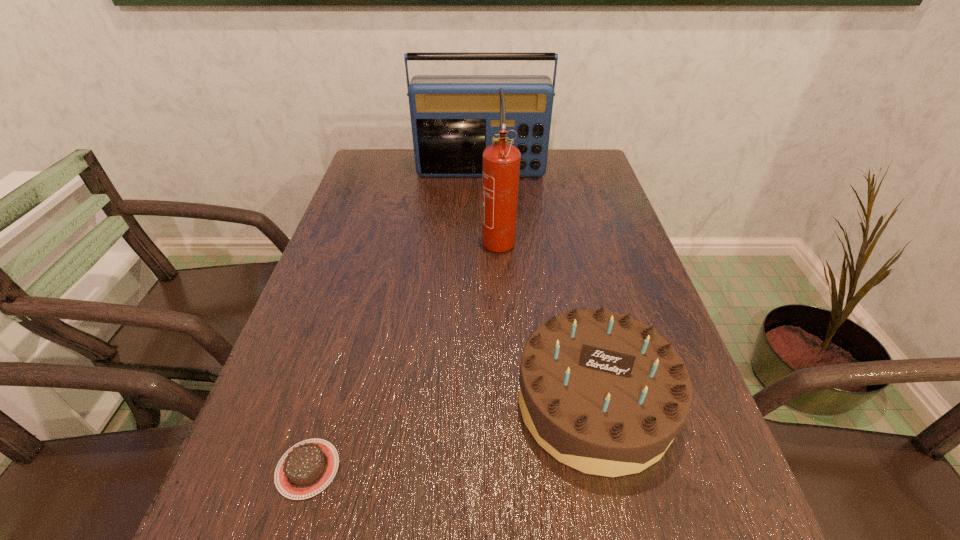
Locate an element on the screen. The width and height of the screenshot is (960, 540). object positioned at the left edge is located at coordinates 307,468.

Where is `object located at the right edge`? This screenshot has width=960, height=540. object located at the right edge is located at coordinates (603, 393).

In the image, there is a desktop. At what (x,y) coordinates should I click in order to perform the action: click on vacant space at the left edge. Please return your answer as a coordinate pair (x, y). Looking at the image, I should click on (354, 268).

Find the location of a particular element. This screenshot has height=540, width=960. vacant point at the right edge is located at coordinates (586, 238).

This screenshot has height=540, width=960. Find the location of `free location at the far right corner`. free location at the far right corner is located at coordinates (564, 181).

The width and height of the screenshot is (960, 540). Find the location of `free point between the farthest object and the birthday cake`. free point between the farthest object and the birthday cake is located at coordinates (538, 287).

At what (x,y) coordinates should I click in order to perform the action: click on vacant region between the second shortest object and the leftmost object. Please return your answer as a coordinate pair (x, y). Looking at the image, I should click on (451, 435).

Identify the location of free space between the third tallest object and the shortest object. (451, 435).

The width and height of the screenshot is (960, 540). What are the coordinates of `vacant space that is in between the leftmost object and the second shortest object` in the screenshot? It's located at (451, 435).

Identify the location of empty space that is in between the second farthest object and the leftmost object. Image resolution: width=960 pixels, height=540 pixels. (403, 353).